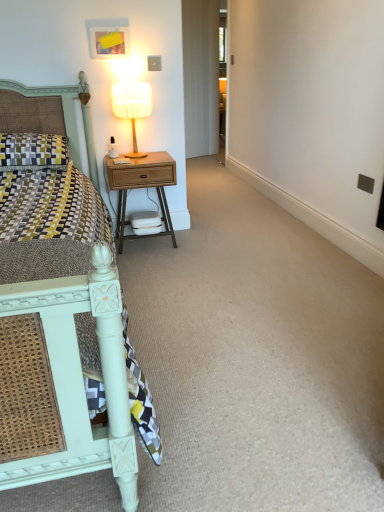
At what (x,y) coordinates should I click in order to perform the action: click on free space in front of woodenmaterial/texturenightstand at left. Please return your answer as a coordinate pair (x, y). This screenshot has width=384, height=512. Looking at the image, I should click on (157, 261).